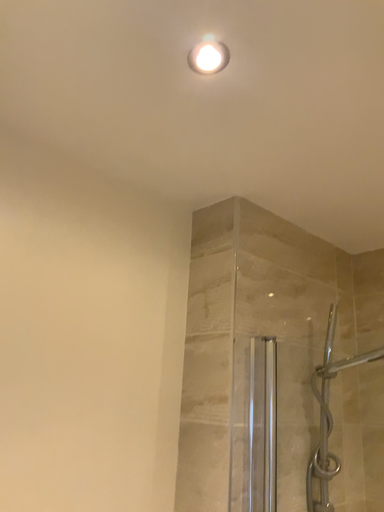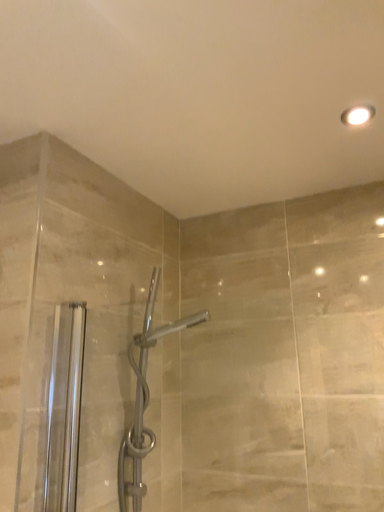
Question: Which way did the camera rotate in the video?

Choices:
 (A) rotated left
 (B) rotated right

Answer: (B)